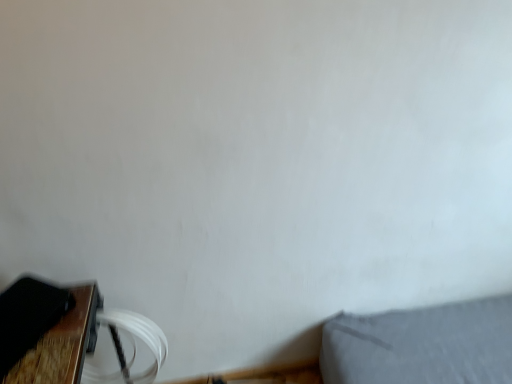
At what (x,y) coordinates should I click in order to perform the action: click on free space above black wood table at lower left (from a real-world perspective). Please return your answer as a coordinate pair (x, y). Looking at the image, I should click on (26, 312).